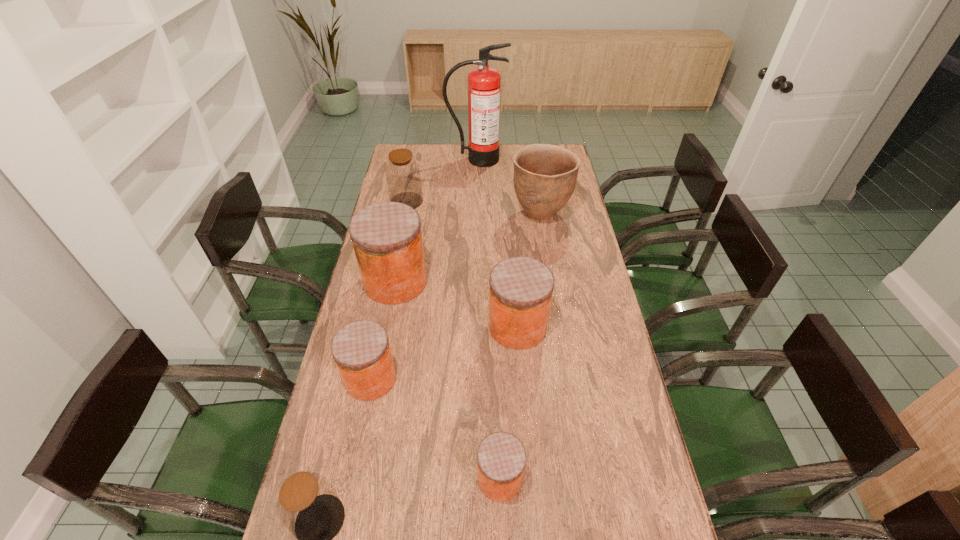
Identify the location of the shortest jar. The height and width of the screenshot is (540, 960). (501, 457).

Where is `free location located 0.210m on the front-facing side of the red fire extinguisher`? Image resolution: width=960 pixels, height=540 pixels. free location located 0.210m on the front-facing side of the red fire extinguisher is located at coordinates (476, 192).

The width and height of the screenshot is (960, 540). I want to click on vacant space located on the back of the pottery, so click(x=533, y=165).

Locate an element on the screen. vacant space situated 0.230m on the back of the tallest jar is located at coordinates (407, 222).

This screenshot has height=540, width=960. I want to click on free space located 0.310m on the back of the second biggest orange jar, so click(512, 245).

Where is `vacant space situated on the back of the bigger brown jar`? vacant space situated on the back of the bigger brown jar is located at coordinates (411, 178).

Locate an element on the screen. The image size is (960, 540). free region located on the back of the sixth farthest object is located at coordinates point(378,341).

The height and width of the screenshot is (540, 960). I want to click on free location located 0.180m on the back of the smallest orange jar, so tap(497, 393).

Image resolution: width=960 pixels, height=540 pixels. Identify the location of object at the far edge. (484, 83).

The width and height of the screenshot is (960, 540). Find the location of `object positioned at the right edge`. object positioned at the right edge is located at coordinates (545, 175).